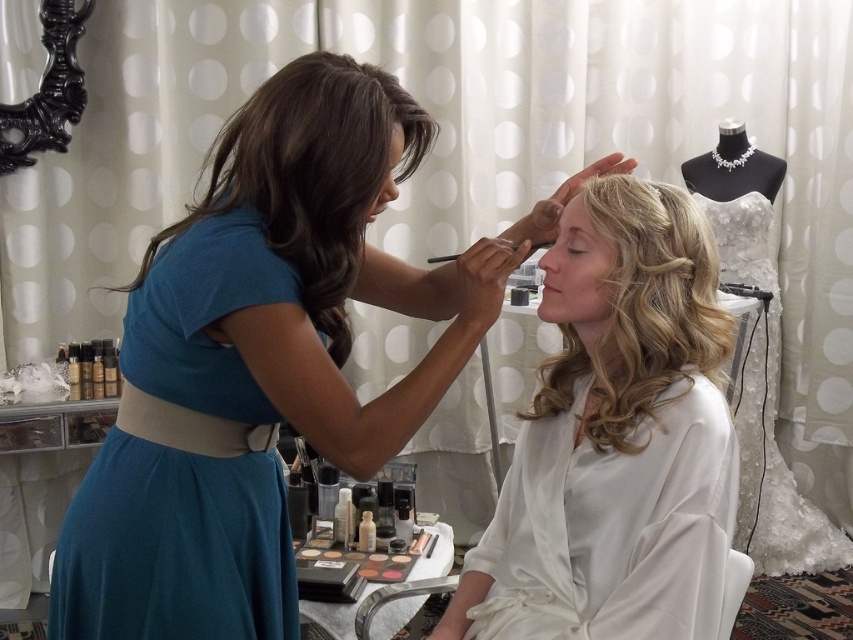
Which is in front, point (584, 426) or point (300, 230)?

Point (300, 230) is in front.

Is point (555, 534) closer to camera compared to point (321, 125)?

No, it is behind (321, 125).

Between point (590, 422) and point (341, 332), which one is positioned in front?

Point (341, 332)

Image resolution: width=853 pixels, height=640 pixels. What are the coordinates of `silky white robe at center` in the screenshot? It's located at (616, 438).

The height and width of the screenshot is (640, 853). Identify the location of teal satin dress at left. (184, 461).

Does teal satin dress at left come behind white lace dress at right?

No, teal satin dress at left is closer to the viewer.

I want to click on teal satin dress at left, so coord(184,461).

Based on the photo, can you confirm if teal satin dress at upper left is thinner than blonde curly hair at center?

No.

Which is in front, point (265, 451) or point (630, 308)?

Point (630, 308) is in front.

Does point (247, 120) lie in front of point (674, 278)?

Yes.

Where is `teal satin dress at upper left`? The width and height of the screenshot is (853, 640). teal satin dress at upper left is located at coordinates (265, 358).